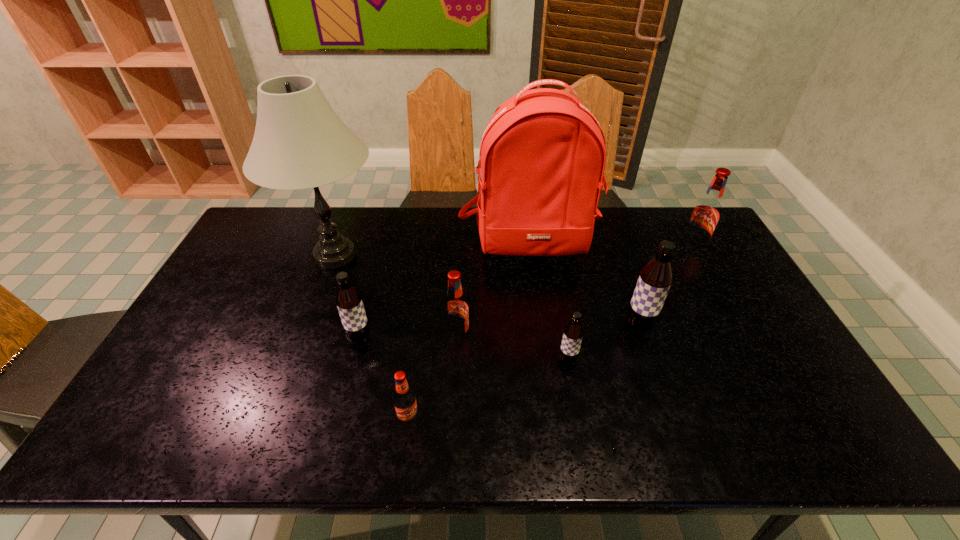
Locate an element on the screen. Image resolution: width=960 pixels, height=540 pixels. unoccupied area between the fifth root beer from left to right and the red backpack is located at coordinates (585, 286).

The width and height of the screenshot is (960, 540). What are the coordinates of `vacant space in between the sixth object from right to left and the lamp` in the screenshot? It's located at (372, 338).

Locate an element on the screen. This screenshot has width=960, height=540. vacant area that lies between the second biggest red root beer and the rightmost red root beer is located at coordinates (575, 293).

Identify which object is the fourth closest to the second root beer from right to left. Please provide its 2D coordinates. Your answer should be formatted as a tuple, i.e. [(x, y)], where the tuple contains the x and y coordinates of a point satisfying the conditions above.

[(456, 314)]

This screenshot has height=540, width=960. I want to click on object that is the seventh closest one to the fourth root beer from left to right, so click(x=706, y=213).

The width and height of the screenshot is (960, 540). I want to click on root beer identified as the third closest to the second brown root beer from left to right, so click(x=404, y=398).

At what (x,y) coordinates should I click in order to perform the action: click on root beer identified as the third closest to the nearest root beer. Please return your answer as a coordinate pair (x, y). The width and height of the screenshot is (960, 540). Looking at the image, I should click on (573, 333).

Where is `red root beer object that ranks as the second closest to the third root beer from left to right`? red root beer object that ranks as the second closest to the third root beer from left to right is located at coordinates (706, 213).

Where is `red root beer that is the closest to the lamp`? The height and width of the screenshot is (540, 960). red root beer that is the closest to the lamp is located at coordinates (456, 314).

Where is `brown root beer that is the third closest to the rightmost object`? This screenshot has width=960, height=540. brown root beer that is the third closest to the rightmost object is located at coordinates (348, 299).